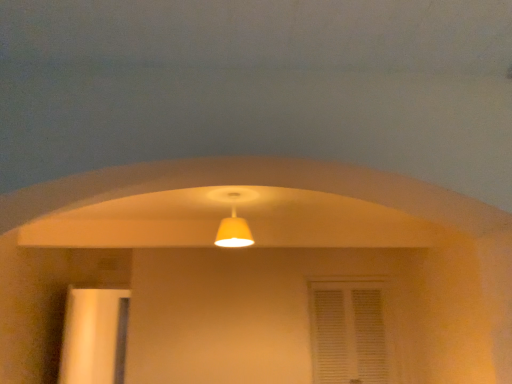
Question: Is matte yellow lampshade at center inside white textured window at center?

Choices:
 (A) no
 (B) yes

Answer: (A)

Question: From the image's perspective, is white textured window at center below matte yellow lampshade at center?

Choices:
 (A) no
 (B) yes

Answer: (B)

Question: Is white textured window at center closer to the viewer compared to matte yellow lampshade at center?

Choices:
 (A) no
 (B) yes

Answer: (A)

Question: From a real-world perspective, is white textured window at center on matte yellow lampshade at center?

Choices:
 (A) yes
 (B) no

Answer: (B)

Question: Considering the relative positions of white textured window at center and matte yellow lampshade at center in the image provided, is white textured window at center to the right of matte yellow lampshade at center from the viewer's perspective?

Choices:
 (A) no
 (B) yes

Answer: (B)

Question: From a real-world perspective, is white textured window at center positioned under matte yellow lampshade at center based on gravity?

Choices:
 (A) no
 (B) yes

Answer: (B)

Question: Is matte yellow lampshade at center aimed at wooden door at left?

Choices:
 (A) no
 (B) yes

Answer: (A)

Question: Can you confirm if matte yellow lampshade at center is bigger than wooden door at left?

Choices:
 (A) no
 (B) yes

Answer: (A)

Question: Can you confirm if matte yellow lampshade at center is thinner than wooden door at left?

Choices:
 (A) yes
 (B) no

Answer: (B)

Question: From a real-world perspective, is matte yellow lampshade at center below wooden door at left?

Choices:
 (A) no
 (B) yes

Answer: (A)

Question: Considering the relative sizes of matte yellow lampshade at center and wooden door at left in the image provided, is matte yellow lampshade at center shorter than wooden door at left?

Choices:
 (A) no
 (B) yes

Answer: (B)

Question: From a real-world perspective, is matte yellow lampshade at center on wooden door at left?

Choices:
 (A) no
 (B) yes

Answer: (B)

Question: Is wooden door at left oriented towards matte yellow lampshade at center?

Choices:
 (A) yes
 (B) no

Answer: (B)